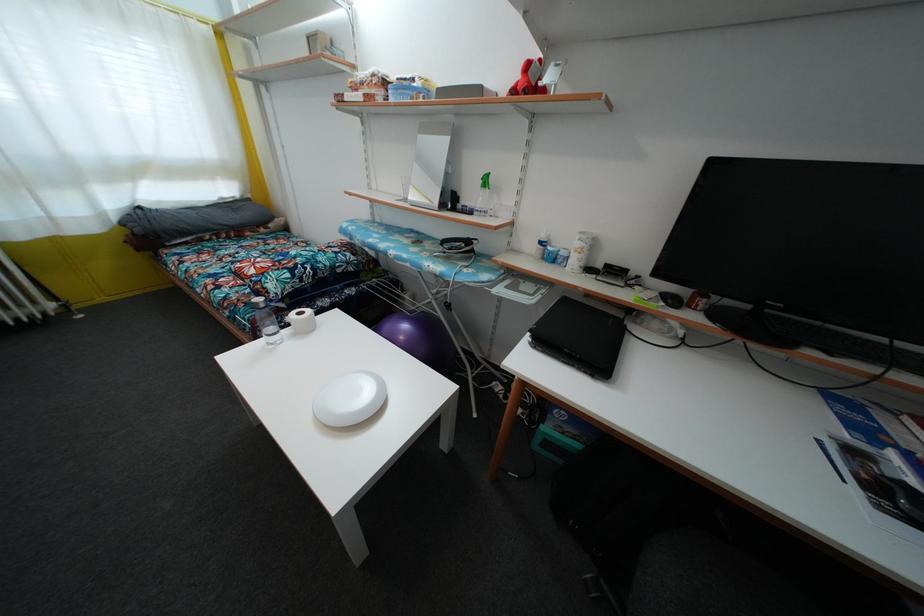
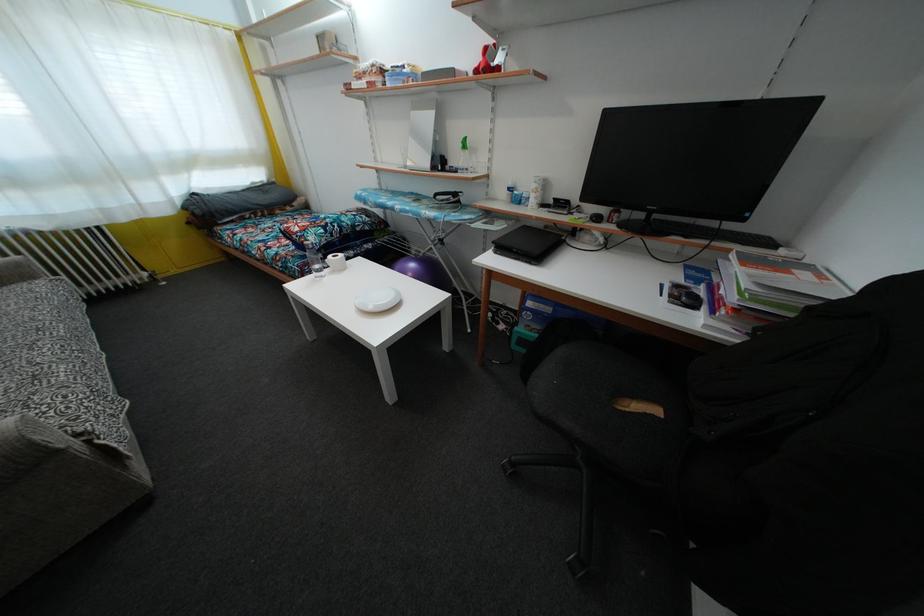
Locate, in the second image, the point that corresponds to (x=886, y=346) in the first image.

(719, 230)